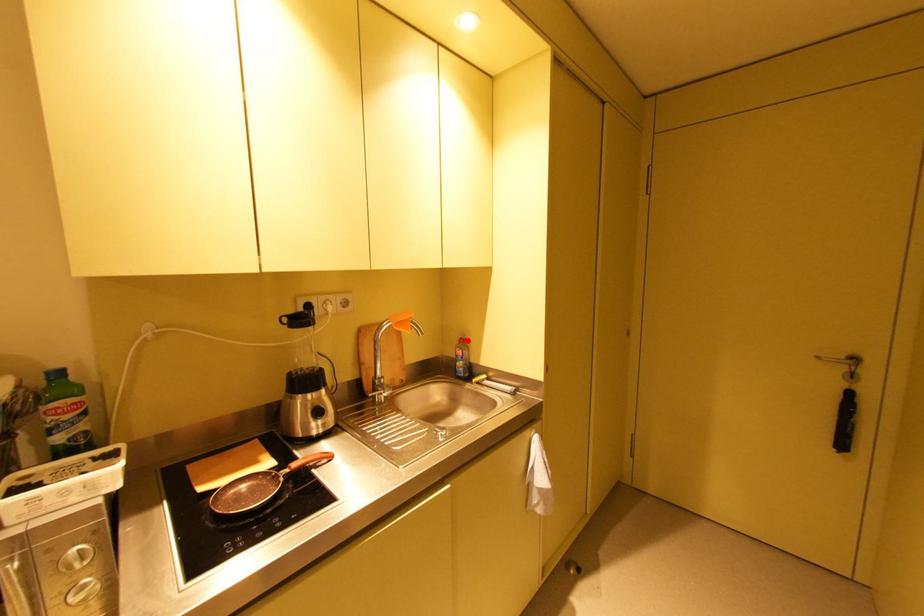
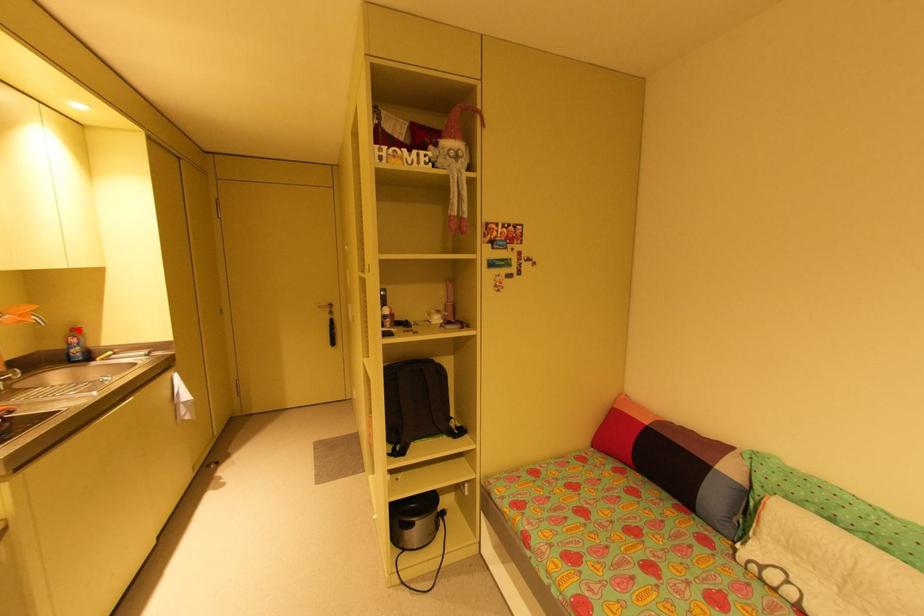
I am providing you with two images of the same scene from different viewpoints. A red point is marked on the first image and another point is marked on the second image. Are the points marked in image1 and image2 representing the same 3D position?

Yes